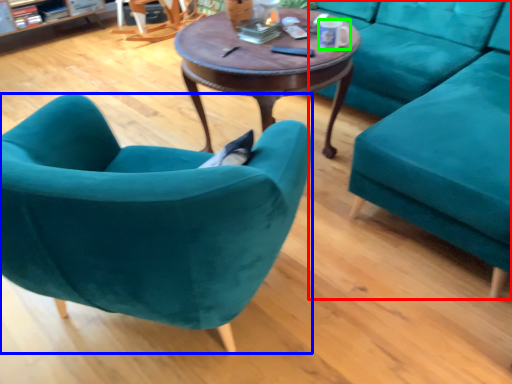
Question: Based on their relative distances, which object is nearer to studio couch (highlighted by a red box)? Choose from chair (highlighted by a blue box) and coffee cup (highlighted by a green box).

Choices:
 (A) chair
 (B) coffee cup

Answer: (B)